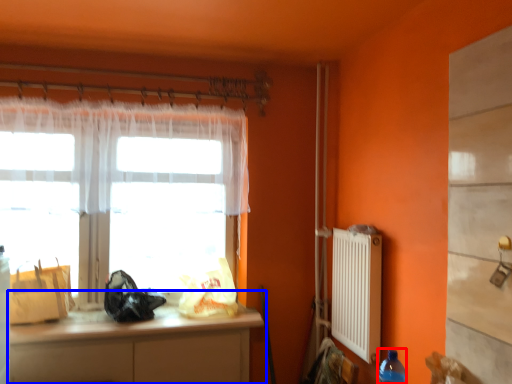
Question: Which object is further to the camera taking this photo, bottle (highlighted by a red box) or cabinetry (highlighted by a blue box)?

Choices:
 (A) bottle
 (B) cabinetry

Answer: (B)